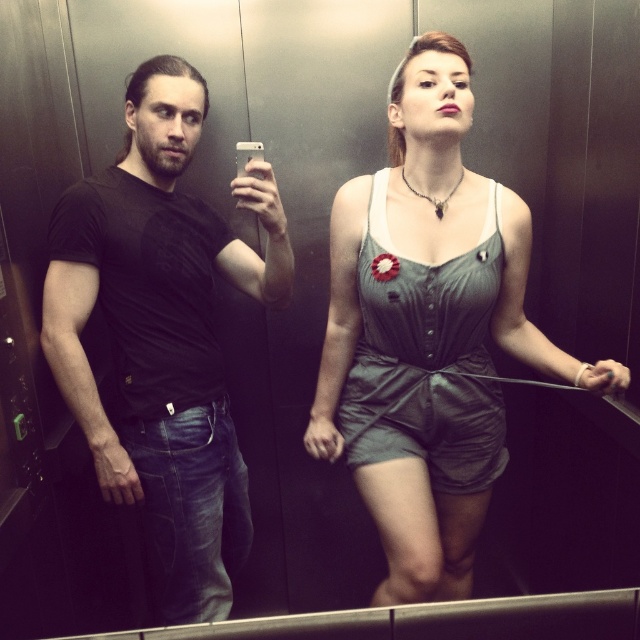
Question: Which object appears closest to the camera in this image?

Choices:
 (A) matte green romper at center
 (B) black matte t-shirt at center

Answer: (B)

Question: Is black matte t-shirt at center positioned behind matte green romper at center?

Choices:
 (A) yes
 (B) no

Answer: (B)

Question: Can you confirm if black matte t-shirt at center is thinner than matte green romper at center?

Choices:
 (A) yes
 (B) no

Answer: (A)

Question: Can you confirm if black matte t-shirt at center is wider than matte green romper at center?

Choices:
 (A) yes
 (B) no

Answer: (B)

Question: Which point is farther to the camera?

Choices:
 (A) (433, 560)
 (B) (273, 243)

Answer: (B)